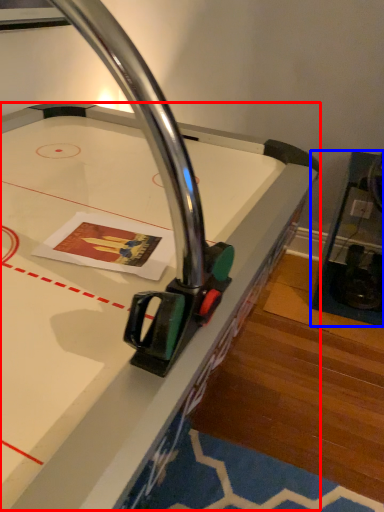
Question: Among these objects, which one is farthest to the camera, table (highlighted by a red box) or furniture (highlighted by a blue box)?

Choices:
 (A) table
 (B) furniture

Answer: (B)